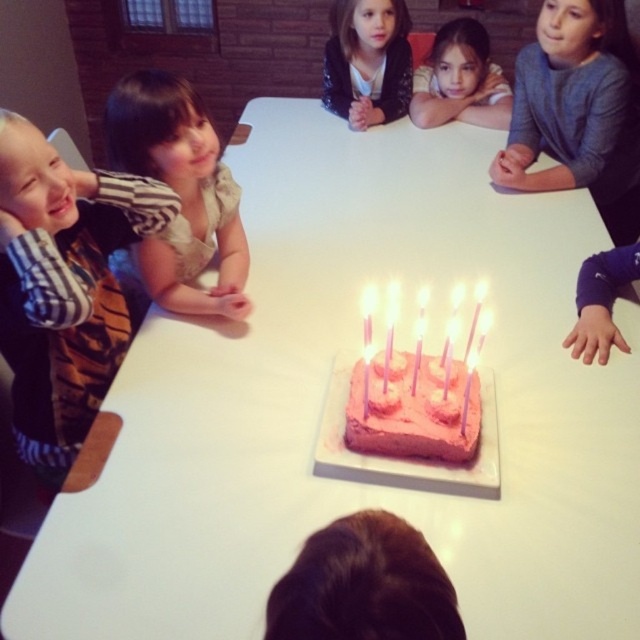
Question: Which object is positioned closest to the matte pink cake at center?

Choices:
 (A) striped fabric shirt at left
 (B) pink frosted cake at center
 (C) dark brown hair at lower center
 (D) smooth beige shirt at upper center

Answer: (D)

Question: Can you confirm if matte beige shirt at upper left is smaller than pink frosted cake at center?

Choices:
 (A) no
 (B) yes

Answer: (A)

Question: Which object is positioned farthest from the matte pink cake at center?

Choices:
 (A) striped fabric shirt at left
 (B) dark brown hair at lower center
 (C) matte beige shirt at upper left

Answer: (B)

Question: Based on their relative distances, which object is farther from the smooth beige shirt at upper center?

Choices:
 (A) dark brown hair at lower center
 (B) striped fabric shirt at left
 (C) pink frosted cake at center

Answer: (A)

Question: Considering the relative positions of matte beige shirt at upper left and smooth beige shirt at upper center in the image provided, where is matte beige shirt at upper left located with respect to smooth beige shirt at upper center?

Choices:
 (A) below
 (B) above

Answer: (A)

Question: Considering the relative positions of striped fabric shirt at left and matte pink cake at center in the image provided, where is striped fabric shirt at left located with respect to matte pink cake at center?

Choices:
 (A) left
 (B) right

Answer: (A)